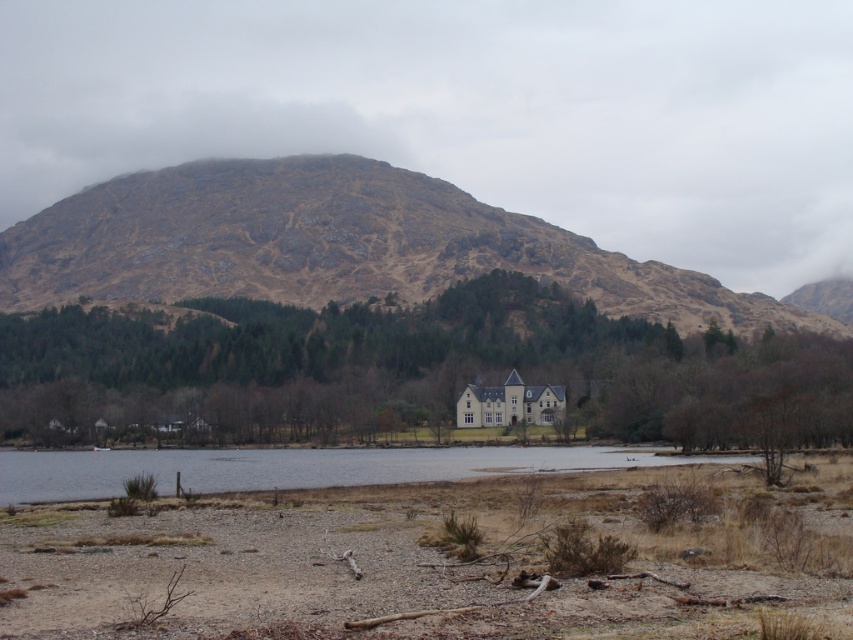
Question: Is dry sand at lower center positioned before clear water at lower center?

Choices:
 (A) no
 (B) yes

Answer: (B)

Question: Which of these objects is positioned farthest from the clear water at lower center?

Choices:
 (A) dry sand at lower center
 (B) rugged brown rock at upper center

Answer: (B)

Question: Which object is the farthest from the dry sand at lower center?

Choices:
 (A) rugged brown rock at upper center
 (B) clear water at lower center

Answer: (A)

Question: Observing the image, what is the correct spatial positioning of rugged brown rock at upper center in reference to clear water at lower center?

Choices:
 (A) left
 (B) right

Answer: (A)

Question: Based on their relative distances, which object is nearer to the rugged brown rock at upper center?

Choices:
 (A) clear water at lower center
 (B) dry sand at lower center

Answer: (A)

Question: Is dry sand at lower center further to the viewer compared to rugged brown rock at upper center?

Choices:
 (A) yes
 (B) no

Answer: (B)